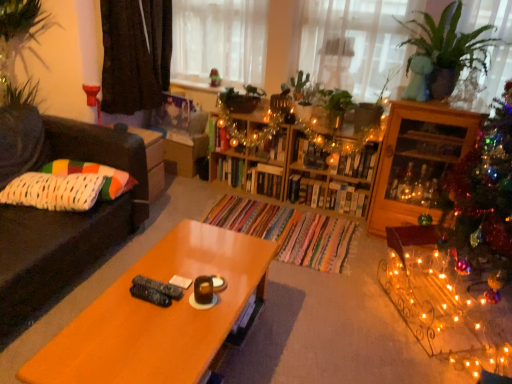
Find the location of a particular element. vacant space in front of wooden bookshelf at center, which is the 2th shelf from left to right is located at coordinates (322, 227).